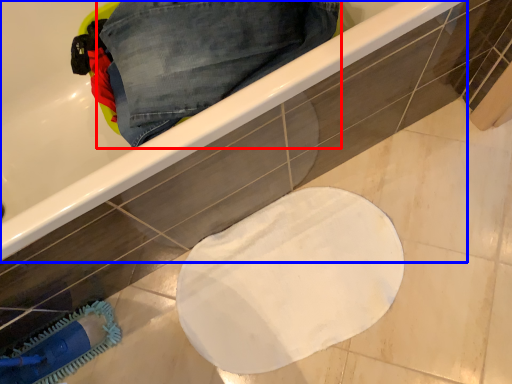
Question: Which of the following is the farthest to the observer, trousers (highlighted by a red box) or bathtub (highlighted by a blue box)?

Choices:
 (A) trousers
 (B) bathtub

Answer: (A)